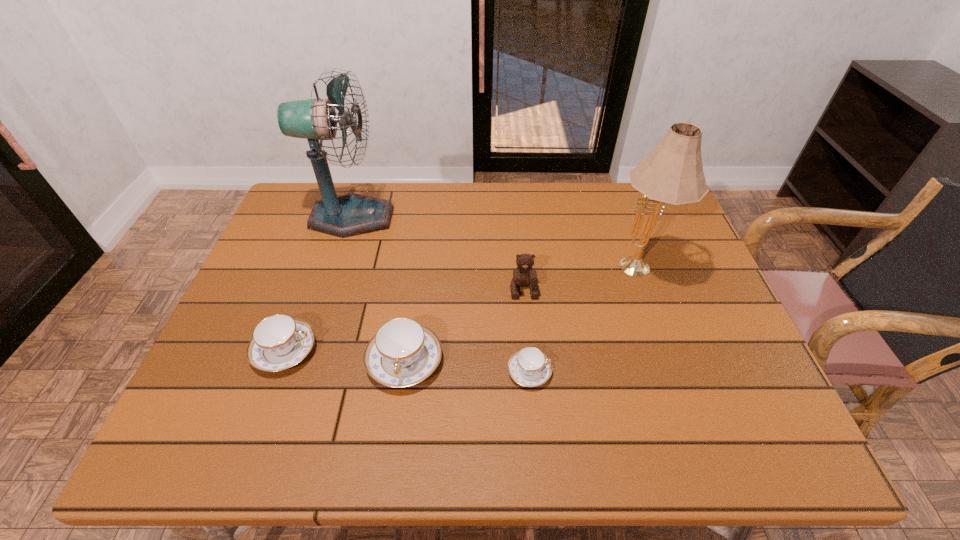
Image resolution: width=960 pixels, height=540 pixels. Identify the location of free space that satisfies the following two spatial constraints: 1. on the face of the fourth shortest object; 2. on the side with the handle of the rightmost teacup. (531, 372).